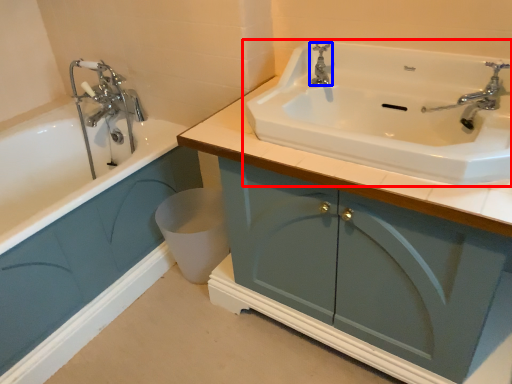
Question: Which object is further to the camera taking this photo, sink (highlighted by a red box) or tap (highlighted by a blue box)?

Choices:
 (A) sink
 (B) tap

Answer: (B)